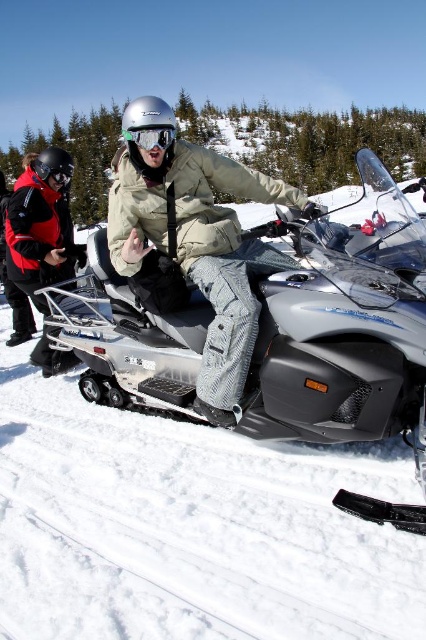
Who is higher up, metallic silver snowmobile at center or light beige fabric jacket at center?

Positioned higher is metallic silver snowmobile at center.

Is point (176, 321) less distant than point (187, 195)?

No, it is behind (187, 195).

Is point (160, 332) less distant than point (210, 337)?

No, it is not.

Locate an element on the screen. The image size is (426, 640). metallic silver snowmobile at center is located at coordinates (344, 324).

Is light beige fabric jacket at center positioned behind clear plastic goggles at center?

No, it is in front of clear plastic goggles at center.

Is light beige fabric jacket at center shorter than clear plastic goggles at center?

A: In fact, light beige fabric jacket at center may be taller than clear plastic goggles at center.

Is point (187, 214) positioned in front of point (169, 131)?

No, it is not.

Where is `light beige fabric jacket at center`? The image size is (426, 640). light beige fabric jacket at center is located at coordinates (195, 244).

Is point (23, 196) behind point (161, 125)?

Yes, point (23, 196) is behind point (161, 125).

Does red jacket at left appear on the left side of clear plastic goggles at center?

Yes, red jacket at left is to the left of clear plastic goggles at center.

Between point (43, 284) and point (169, 136), which one is positioned in front?

Point (169, 136) is more forward.

Identify the location of red jacket at left. Image resolution: width=426 pixels, height=640 pixels. [x=40, y=225].